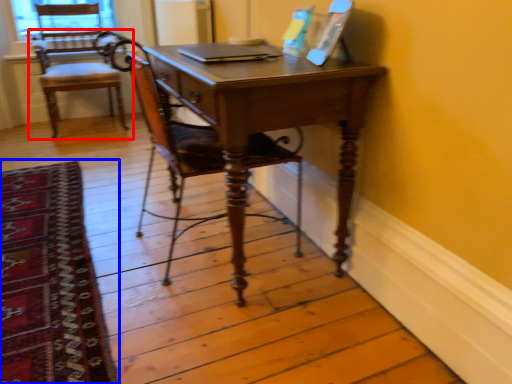
Question: Which point is further to the camera, chair (highlighted by a red box) or mat (highlighted by a blue box)?

Choices:
 (A) chair
 (B) mat

Answer: (A)